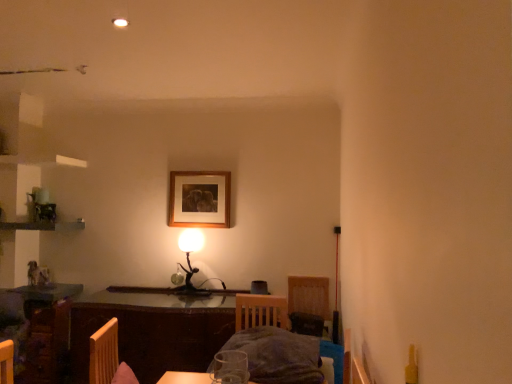
Question: Visually, is dark gray fabric bed at center positioned to the left or to the right of wooden picture frame at upper center?

Choices:
 (A) right
 (B) left

Answer: (A)

Question: In terms of width, does dark gray fabric bed at center look wider or thinner when compared to wooden picture frame at upper center?

Choices:
 (A) thin
 (B) wide

Answer: (B)

Question: Which is nearer to the velvet dark gray armchair at lower center?

Choices:
 (A) metallic gold table lamp at center
 (B) wooden table at center
 (C) wooden picture frame at upper center
 (D) dark gray fabric bed at center

Answer: (A)

Question: Which object is the closest to the wooden table at center?

Choices:
 (A) metallic gold table lamp at center
 (B) dark gray fabric bed at center
 (C) wooden picture frame at upper center
 (D) velvet dark gray armchair at lower center

Answer: (A)